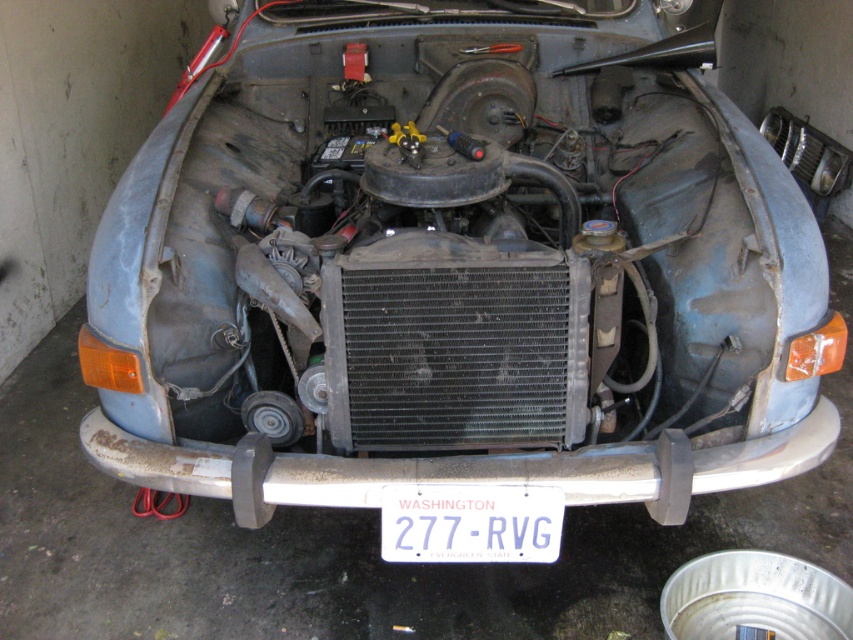
Question: Considering the relative positions of metallic silver bumper at center and white plastic license plate at center in the image provided, where is metallic silver bumper at center located with respect to white plastic license plate at center?

Choices:
 (A) below
 (B) above

Answer: (B)

Question: Which object is farther from the camera taking this photo?

Choices:
 (A) white plastic license plate at center
 (B) metallic silver bumper at center

Answer: (B)

Question: Does metallic silver bumper at center have a smaller size compared to white plastic license plate at center?

Choices:
 (A) no
 (B) yes

Answer: (A)

Question: Which point is farther to the camera?

Choices:
 (A) (445, 560)
 (B) (412, 480)

Answer: (A)

Question: Is metallic silver bumper at center thinner than white plastic license plate at center?

Choices:
 (A) yes
 (B) no

Answer: (B)

Question: Which of the following is the closest to the observer?

Choices:
 (A) white plastic license plate at center
 (B) metallic silver bumper at center

Answer: (A)